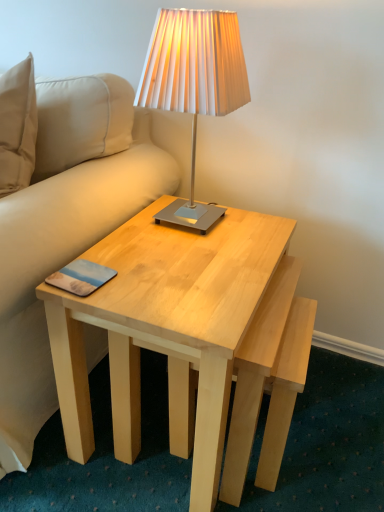
The image size is (384, 512). What are the coordinates of `vacant area on top of light wood coffee table at center (from a real-world perspective)` in the screenshot? It's located at (194, 249).